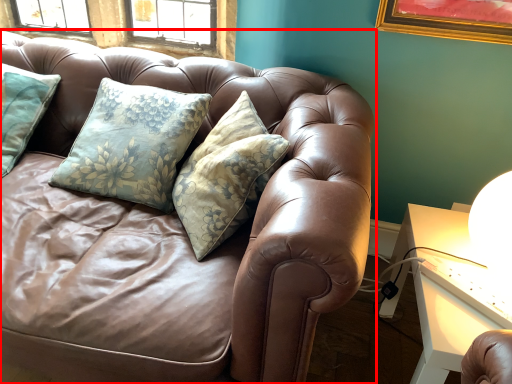
Question: From the image's perspective, what is the correct spatial relationship of studio couch (annotated by the red box) in relation to table?

Choices:
 (A) above
 (B) below

Answer: (A)